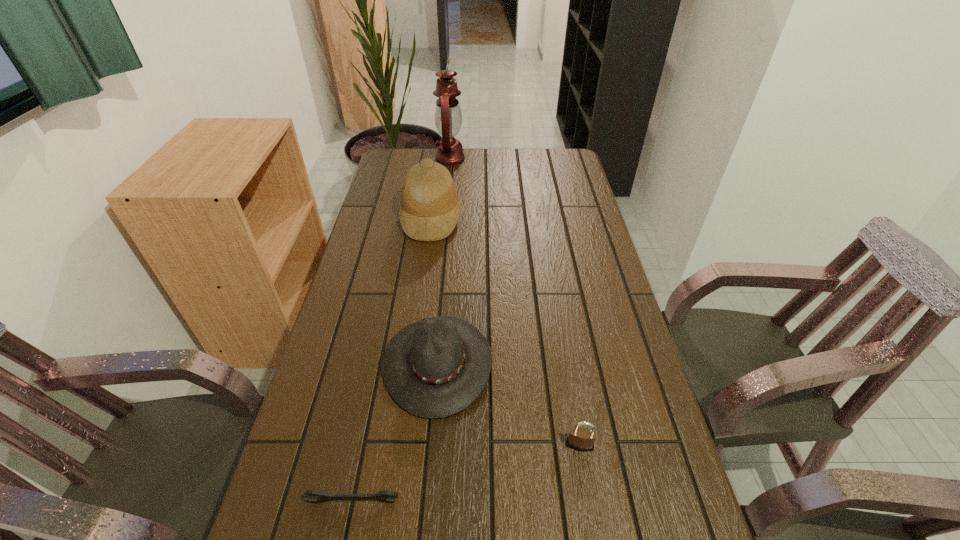
Locate an element on the screen. This screenshot has width=960, height=540. oil lamp is located at coordinates (448, 118).

You are a GUI agent. You are given a task and a screenshot of the screen. Output one action in this format:
    pyautogui.click(x=<x>, y=<y>)
    Task: Click on the tallest object
    
    Given the screenshot: What is the action you would take?
    pyautogui.click(x=448, y=118)

Find the location of a particular element. This screenshot has width=960, height=540. the taller hat is located at coordinates (429, 210).

Find the location of a particular element. The image size is (960, 540). the fourth shortest object is located at coordinates (429, 210).

Where is `the shorter hat`? The width and height of the screenshot is (960, 540). the shorter hat is located at coordinates (434, 368).

Identify the location of the third nearest object. (434, 368).

Image resolution: width=960 pixels, height=540 pixels. In order to click on the rightmost object in this screenshot , I will do `click(582, 439)`.

Identify the location of padlock. (582, 439).

Identify the location of the nearest object. (386, 496).

This screenshot has height=540, width=960. I want to click on the shortest object, so click(386, 496).